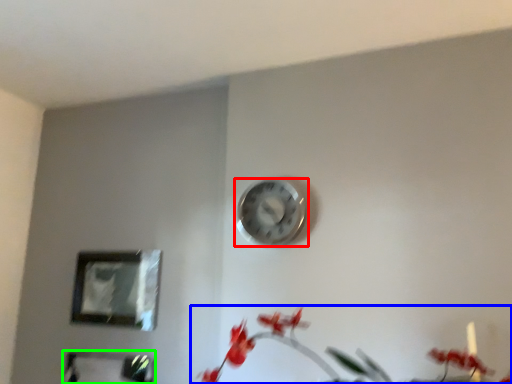
Question: Which object is the closest to the wall clock (highlighted by a red box)? Choose among these: floral arrangement (highlighted by a blue box) or picture frame (highlighted by a green box).

Choices:
 (A) floral arrangement
 (B) picture frame

Answer: (A)